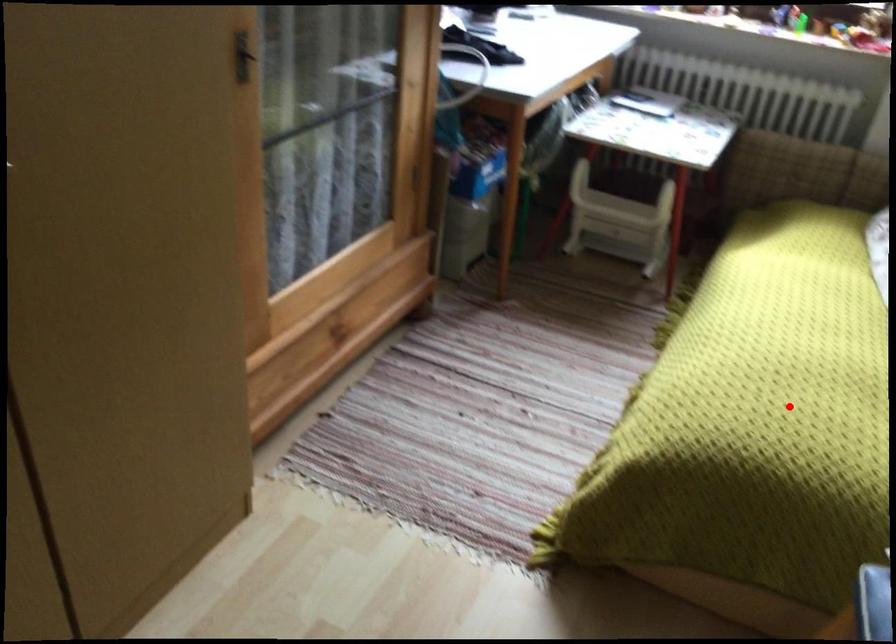
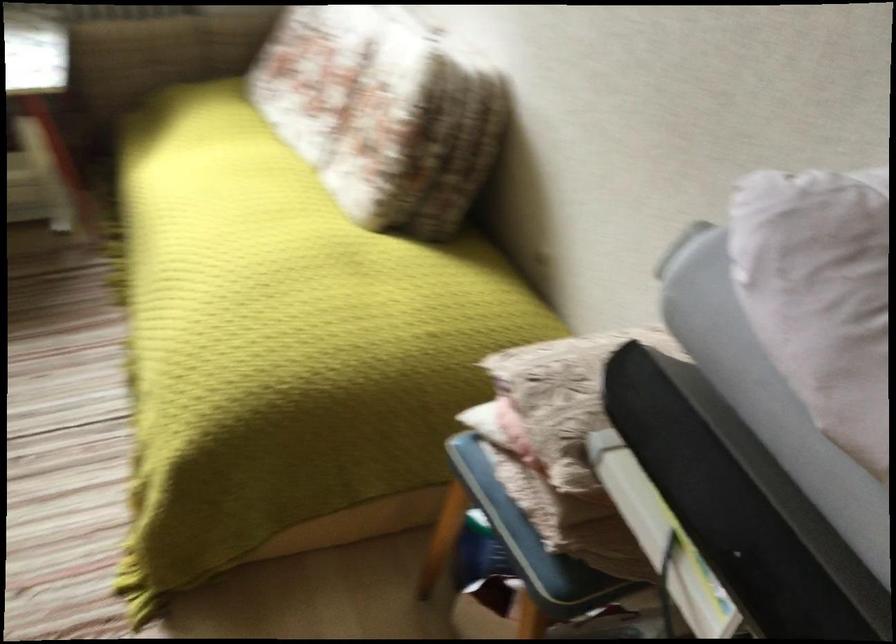
The point at the highlighted location is marked in the first image. Where is the corresponding point in the second image?

(290, 314)